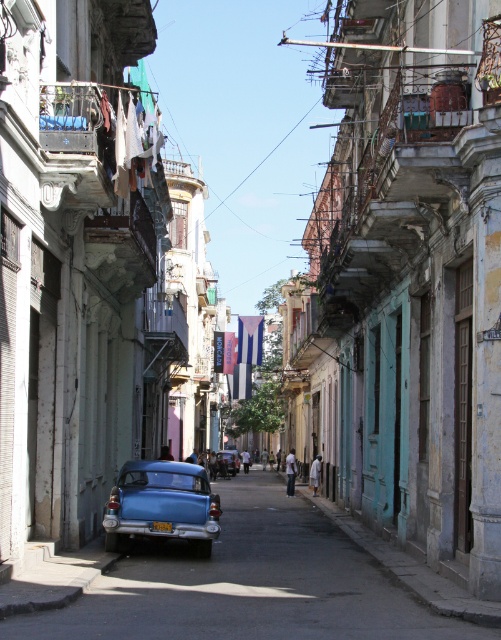
From the picture: You are a delivery person who needs to park your van in this street. There is a metallic blue car at center. Where should you park your van so that it doesn not block the view of the Cuban flag? Please provide coordinates in the format of x,y between 0 and 1.

The metallic blue car at center is located at coordinates [247,584]. To avoid blocking the view of the Cuban flag, you should park your van either to the left or right of the car, ensuring that the flag remains visible. The safest option would be to park at coordinates [250,320], which is directly in front of the Cuban flag.

You are a delivery driver who needs to park your vehicle in this street. You have two options for parking spots next to the two cars at the center. The first spot is next to the metallic blue car at center, and the second spot is next to the matte blue car at center. Which parking spot will give you more vertical clearance for your delivery truck?

The parking spot next to the matte blue car at center will provide more vertical clearance because the metallic blue car at center is much taller than the matte blue car at center, so the space next to it would be lower.

You are a tourist standing on the street and want to take a photo of both the metallic blue car at center and the matte blue car at center. Since the Cuban flag is in the background, you want to ensure both cars are fully visible in the frame. Which car should you position closer to the camera to achieve this?

You should position the matte blue car at center closer to the camera because the metallic blue car at center is to the right of it, so adjusting the matte blue car at center forward would allow both to be in frame without the Cuban flag blocking them.